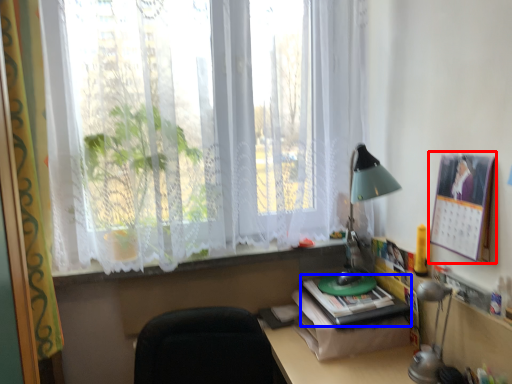
Question: Which object appears closest to the camera in this image, bulletin board (highlighted by a red box) or paperback book (highlighted by a blue box)?

Choices:
 (A) bulletin board
 (B) paperback book

Answer: (A)